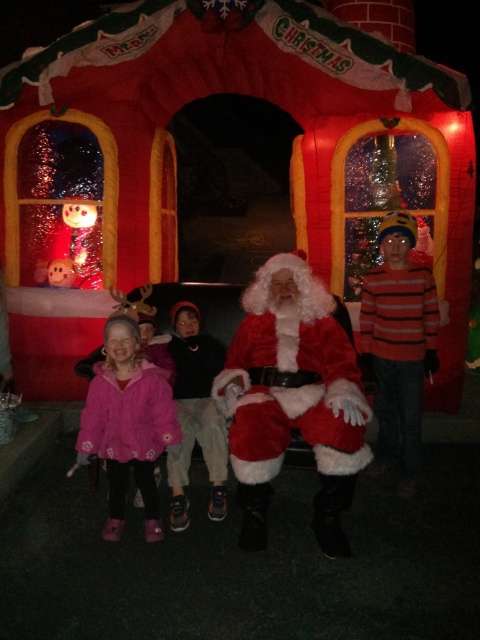
You are standing at the point with coordinates (291, 397) in the image. What object are you directly in front of?

You are directly in front of the fuzzy red santa at center.

Looking at this image, you are a photographer trying to capture a photo of the fuzzy white Santa at center. Based on the scene description, where should you position yourself to ensure Santa is centered in your shot?

To center the fuzzy white Santa at center in your photo, position yourself directly in front of the Santa at the coordinates provided, ensuring the camera is aligned with the point mentioned.

You are a photographer trying to capture a clear photo of both the fuzzy white santa at center and the fuzzy red santa at center. Which one will appear closer to you in the photo?

The fuzzy white santa at center will appear closer in the photo because it is positioned closer to the viewer than the fuzzy red santa at center.